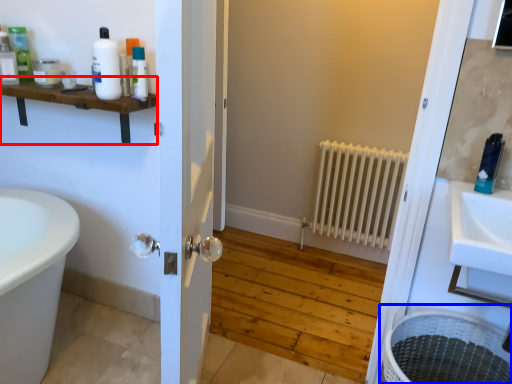
Question: Which object appears closest to the camera in this image, balustrade (highlighted by a red box) or laundry basket (highlighted by a blue box)?

Choices:
 (A) balustrade
 (B) laundry basket

Answer: (B)